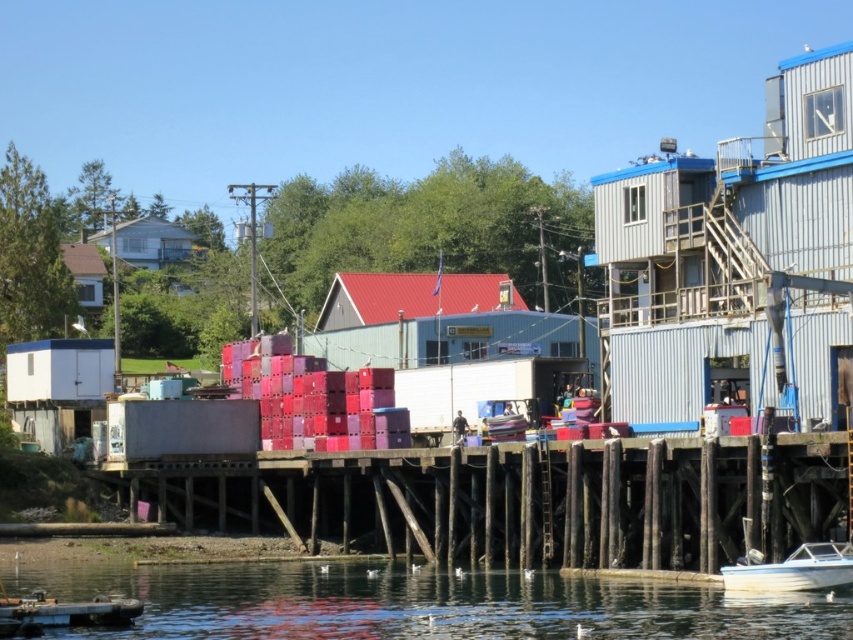
Question: Is red corrugated metal hut at center positioned at the back of white glossy boat at lower right?

Choices:
 (A) no
 (B) yes

Answer: (B)

Question: Does metallic corrugated hut at right appear on the left side of red corrugated metal hut at center?

Choices:
 (A) no
 (B) yes

Answer: (A)

Question: Among these points, which one is nearest to the camera?

Choices:
 (A) (820, 204)
 (B) (741, 584)
 (C) (392, 285)
 (D) (699, 445)

Answer: (B)

Question: Which object appears farthest from the camera in this image?

Choices:
 (A) transparent water at lower center
 (B) white glossy boat at lower right
 (C) metallic corrugated hut at right

Answer: (C)

Question: Is wooden dock at lower center bigger than transparent water at lower center?

Choices:
 (A) no
 (B) yes

Answer: (B)

Question: Which is nearer to the light brown wooden house at upper left?

Choices:
 (A) red corrugated metal hut at center
 (B) white glossy boat at lower right
 (C) wooden dock at lower center
 (D) metallic corrugated hut at right

Answer: (A)